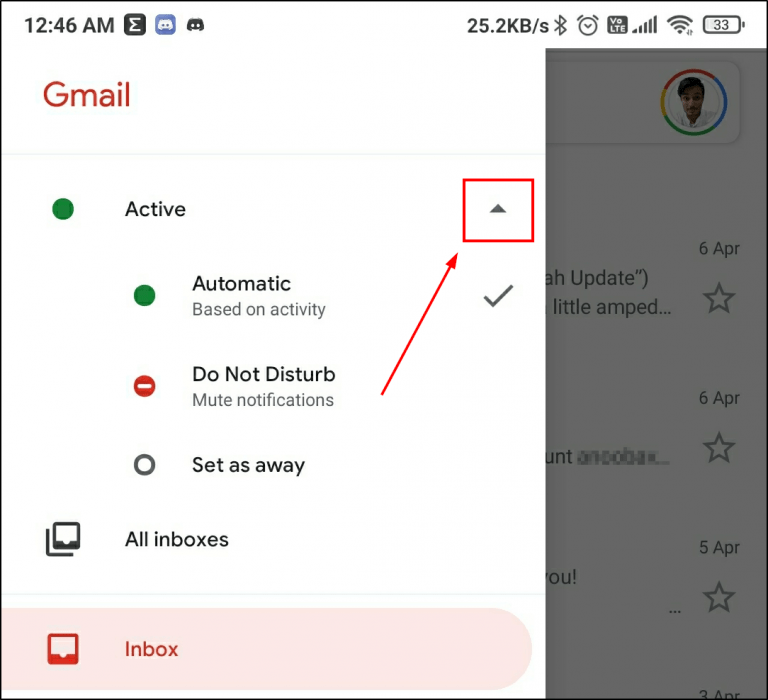
I want to click on alarm clock ion, so click(x=588, y=27).